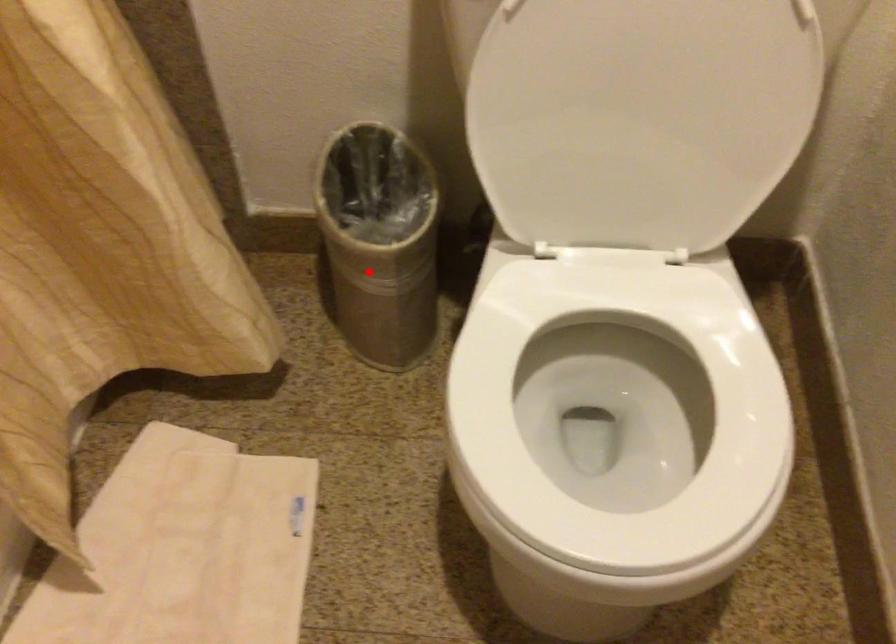
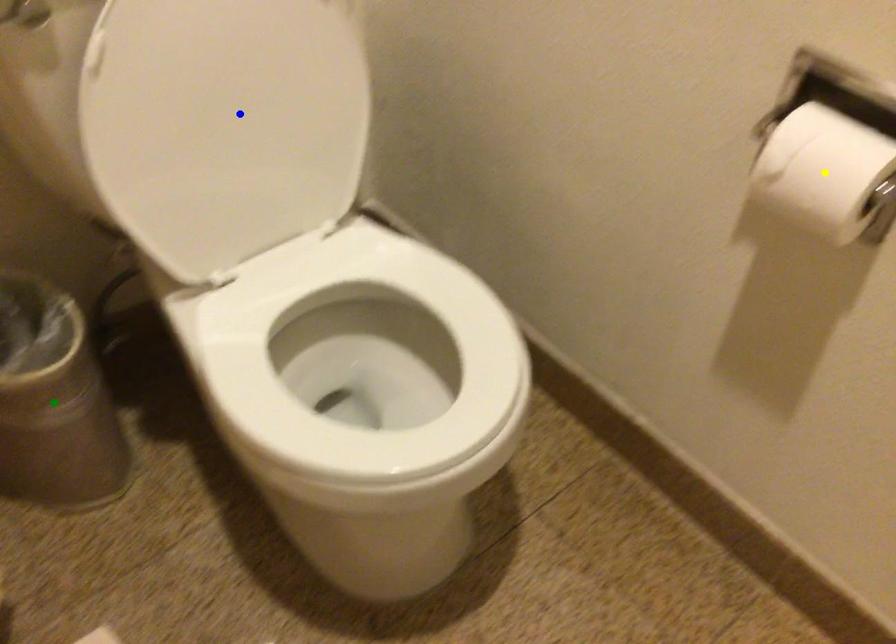
Question: I am providing you with two images of the same scene from different viewpoints. A red point is marked on the first image. You are given multiple points on the second image. Can you choose the point in image 2 that corresponds to the point in image 1?

Choices:
 (A) green point
 (B) blue point
 (C) yellow point

Answer: (A)